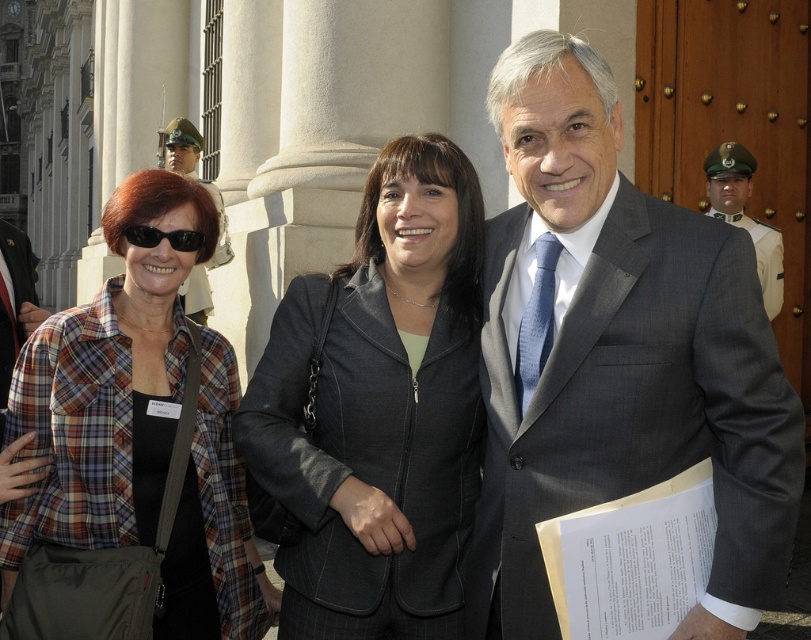
Question: Is plaid fabric shirt at left to the left of matte black jacket at left from the viewer's perspective?

Choices:
 (A) no
 (B) yes

Answer: (B)

Question: Which object is closer to the camera taking this photo?

Choices:
 (A) matte black jacket at left
 (B) green uniformed guard at center

Answer: (A)

Question: Which object appears farthest from the camera in this image?

Choices:
 (A) green uniformed guard at center
 (B) dark gray suit at center

Answer: (A)

Question: Observing the image, what is the correct spatial positioning of gray suit at center in reference to plaid shirt at left?

Choices:
 (A) below
 (B) above

Answer: (B)

Question: Which object appears farthest from the camera in this image?

Choices:
 (A) dark gray suit at center
 (B) matte black jacket at left

Answer: (B)

Question: Can you confirm if plaid shirt at left is positioned below matte black jacket at left?

Choices:
 (A) no
 (B) yes

Answer: (B)